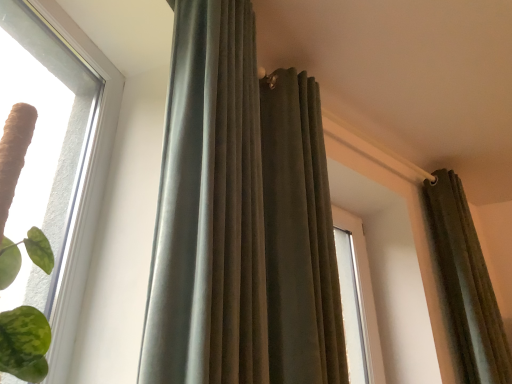
Question: Which direction should I rotate to face velvet-like gray curtain at center, placed as the 3th curtain when sorted from right to left, — up or down?

Choices:
 (A) up
 (B) down

Answer: (A)

Question: Is velvet olive curtain at upper right, which is the 3th curtain in left-to-right order, shorter than velvet olive curtain at upper center, positioned as the 2th curtain in left-to-right order?

Choices:
 (A) yes
 (B) no

Answer: (A)

Question: Does velvet olive curtain at upper right, which is the 3th curtain in left-to-right order, have a smaller size compared to velvet olive curtain at upper center, arranged as the 2th curtain when viewed from the right?

Choices:
 (A) no
 (B) yes

Answer: (B)

Question: From a real-world perspective, is velvet olive curtain at upper right, which appears as the 1th curtain when viewed from the right, on top of velvet olive curtain at upper center, arranged as the 2th curtain when viewed from the right?

Choices:
 (A) no
 (B) yes

Answer: (B)

Question: Is velvet olive curtain at upper right, which appears as the 1th curtain when viewed from the right, surrounding velvet olive curtain at upper center, arranged as the 2th curtain when viewed from the right?

Choices:
 (A) yes
 (B) no

Answer: (B)

Question: Considering the relative positions of velvet olive curtain at upper right, which is the 3th curtain in left-to-right order, and velvet olive curtain at upper center, arranged as the 2th curtain when viewed from the right, in the image provided, is velvet olive curtain at upper right, which is the 3th curtain in left-to-right order, to the left of velvet olive curtain at upper center, arranged as the 2th curtain when viewed from the right, from the viewer's perspective?

Choices:
 (A) yes
 (B) no

Answer: (B)

Question: Does velvet olive curtain at upper right, which appears as the 1th curtain when viewed from the right, have a greater height compared to velvet olive curtain at upper center, positioned as the 2th curtain in left-to-right order?

Choices:
 (A) yes
 (B) no

Answer: (B)

Question: Can you confirm if clear glass window at upper left is bigger than velvet-like gray curtain at center, placed as the 3th curtain when sorted from right to left?

Choices:
 (A) no
 (B) yes

Answer: (A)

Question: Considering the relative sizes of clear glass window at upper left and velvet-like gray curtain at center, placed as the 3th curtain when sorted from right to left, in the image provided, is clear glass window at upper left wider than velvet-like gray curtain at center, placed as the 3th curtain when sorted from right to left,?

Choices:
 (A) yes
 (B) no

Answer: (A)

Question: Is clear glass window at upper left further to camera compared to velvet-like gray curtain at center, placed as the 3th curtain when sorted from right to left?

Choices:
 (A) yes
 (B) no

Answer: (B)

Question: Considering the relative sizes of clear glass window at upper left and velvet-like gray curtain at center, placed as the 3th curtain when sorted from right to left, in the image provided, is clear glass window at upper left thinner than velvet-like gray curtain at center, placed as the 3th curtain when sorted from right to left,?

Choices:
 (A) yes
 (B) no

Answer: (B)

Question: Considering the relative sizes of clear glass window at upper left and velvet-like gray curtain at center, the 1th curtain viewed from the left, in the image provided, is clear glass window at upper left taller than velvet-like gray curtain at center, the 1th curtain viewed from the left,?

Choices:
 (A) yes
 (B) no

Answer: (B)

Question: Could you tell me if clear glass window at upper left is facing velvet-like gray curtain at center, the 1th curtain viewed from the left?

Choices:
 (A) no
 (B) yes

Answer: (A)

Question: Considering the relative sizes of clear glass window at upper left and velvet olive curtain at upper right, which appears as the 1th curtain when viewed from the right, in the image provided, is clear glass window at upper left bigger than velvet olive curtain at upper right, which appears as the 1th curtain when viewed from the right,?

Choices:
 (A) yes
 (B) no

Answer: (B)